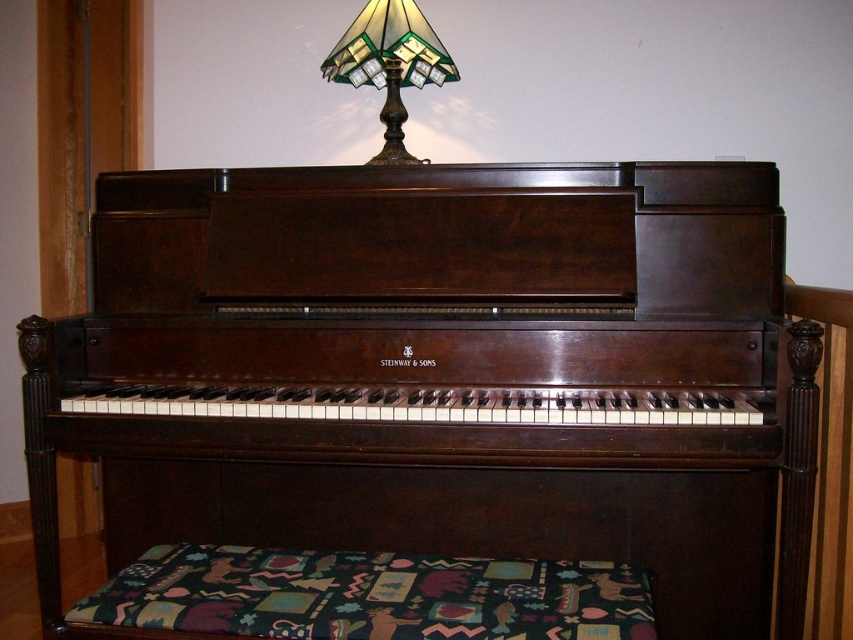
Based on the photo, you need to move both the shiny dark wood piano at center and the dark fabric footrest at lower center to another room. Considering their sizes, which one will be harder to move through a narrow doorway?

The shiny dark wood piano at center has a larger size compared to the dark fabric footrest at lower center, so it will be harder to move through a narrow doorway.

You are a piano teacher who wants to adjust the placement of the shiny dark wood piano at center and the dark fabric footrest at lower center. Can you move the footrest to the right side of the piano without moving the piano?

The shiny dark wood piano at center is positioned over dark fabric footrest at lower center, so the footrest is currently underneath the piano. To move the footrest to the right side of the piano, you would need to first move the piano to allow access, as the footrest is currently blocked by the piano.

From the picture: You are standing in front of the piano and want to place a small vase on the piano. The piano is represented by the point at coordinates point (442, 374). Where should you place the vase to ensure it is centered on the piano?

The shiny dark wood piano at center is represented by point (442, 374), so placing the vase at the center coordinates of the piano would mean positioning it at point (442, 374).